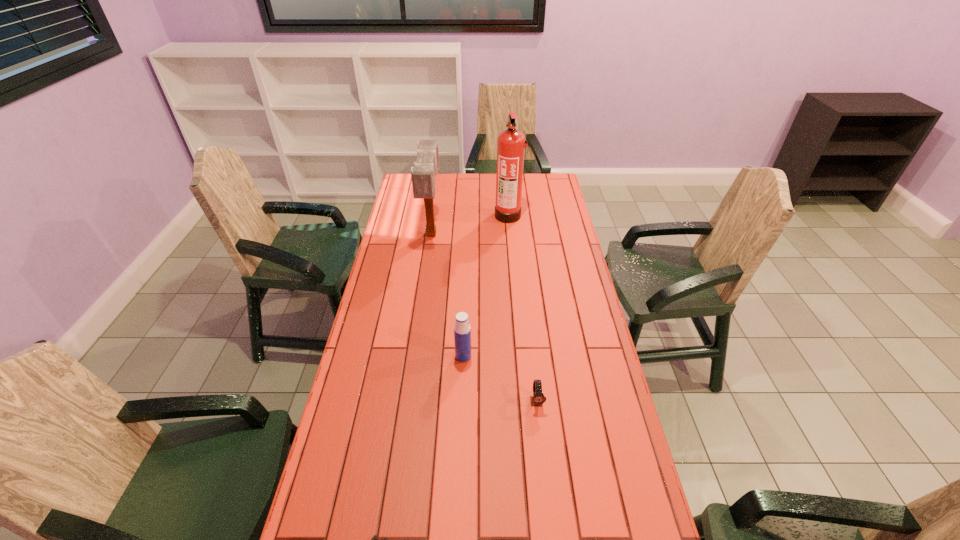
At what (x,y) coordinates should I click in order to perform the action: click on fire extinguisher. Please return your answer as a coordinate pair (x, y). Looking at the image, I should click on (511, 145).

The image size is (960, 540). I want to click on mallet, so click(423, 173).

Where is `water bottle`? The image size is (960, 540). water bottle is located at coordinates (462, 330).

I want to click on the third shortest object, so click(x=462, y=330).

Locate an element on the screen. the second nearest object is located at coordinates (537, 399).

Find the location of a particular element. This screenshot has height=540, width=960. watch is located at coordinates (537, 399).

Find the location of a particular element. The width and height of the screenshot is (960, 540). vacant space located with the nozzle pointing from the back of the fire extinguisher is located at coordinates (452, 215).

Identify the location of free point located with the nozzle pointing from the back of the fire extinguisher. The height and width of the screenshot is (540, 960). (477, 215).

The height and width of the screenshot is (540, 960). What are the coordinates of `free location located 0.250m with the nozzle pointing from the back of the fire extinguisher` in the screenshot? It's located at (441, 215).

Image resolution: width=960 pixels, height=540 pixels. Identify the location of vacant space situated on the back of the mallet. (440, 176).